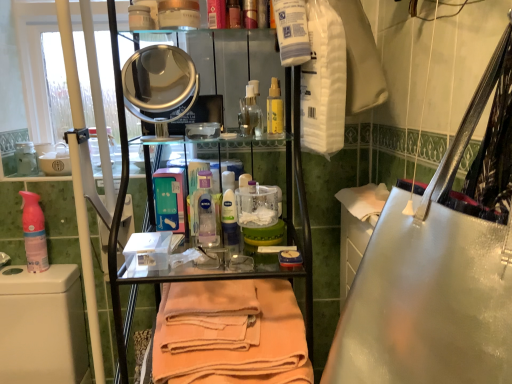
Question: Looking at their shapes, would you say orange cotton towel at center is wider or thinner than translucent plastic bottle at center, the second cleaning product viewed from the back?

Choices:
 (A) thin
 (B) wide

Answer: (B)

Question: In terms of size, does orange cotton towel at center appear bigger or smaller than translucent plastic bottle at center, the second cleaning product viewed from the back?

Choices:
 (A) big
 (B) small

Answer: (A)

Question: Considering the real-world distances, which object is farthest from the yellow matte bottle at center?

Choices:
 (A) pink matte spray can at left, the 2th cleaning product viewed from the right
 (B) orange cotton towel at center
 (C) white plastic toilet at lower left
 (D) translucent plastic bottle at center, the second cleaning product viewed from the back

Answer: (C)

Question: Which is farther from the yellow matte bottle at center?

Choices:
 (A) white plastic toilet at lower left
 (B) translucent plastic bottle at center, arranged as the first cleaning product when viewed from the front
 (C) orange cotton towel at center
 (D) pink matte spray can at left, which is the 2th cleaning product from front to back

Answer: (A)